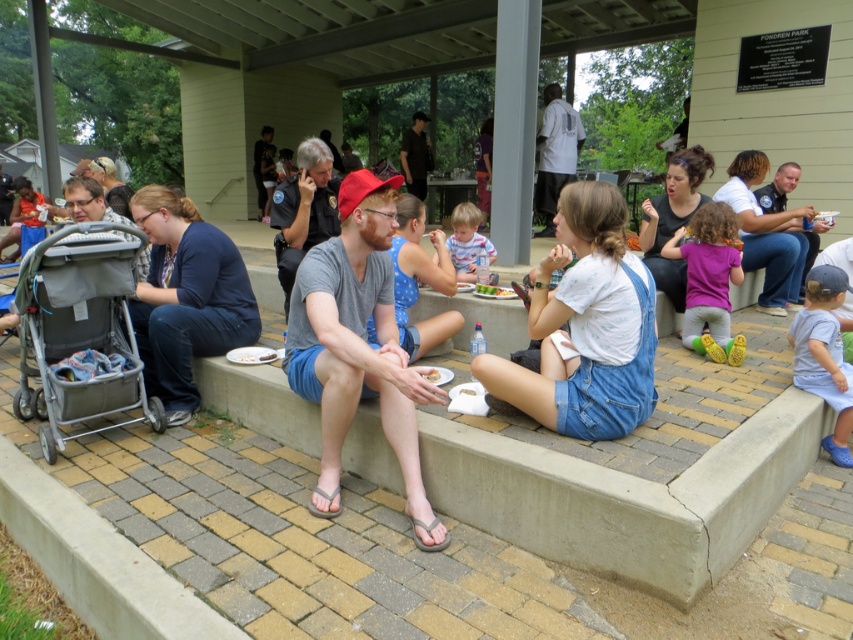
Question: Can you confirm if purple cotton shirt at center is positioned below blue denim shorts at lower right?

Choices:
 (A) no
 (B) yes

Answer: (A)

Question: Which point is closer to the camera?

Choices:
 (A) (730, 273)
 (B) (466, 250)
 (C) (804, 365)

Answer: (C)

Question: Estimate the real-world distances between objects in this image. Which object is farther from the light brown hair at center?

Choices:
 (A) purple cotton shirt at center
 (B) blue denim shorts at lower right

Answer: (B)

Question: Is blue denim shorts at lower right to the right of light brown hair at center from the viewer's perspective?

Choices:
 (A) yes
 (B) no

Answer: (A)

Question: Is blue denim shorts at lower right below light brown hair at center?

Choices:
 (A) no
 (B) yes

Answer: (B)

Question: Which object is positioned farthest from the blue denim shorts at lower right?

Choices:
 (A) purple cotton shirt at center
 (B) light brown hair at center

Answer: (B)